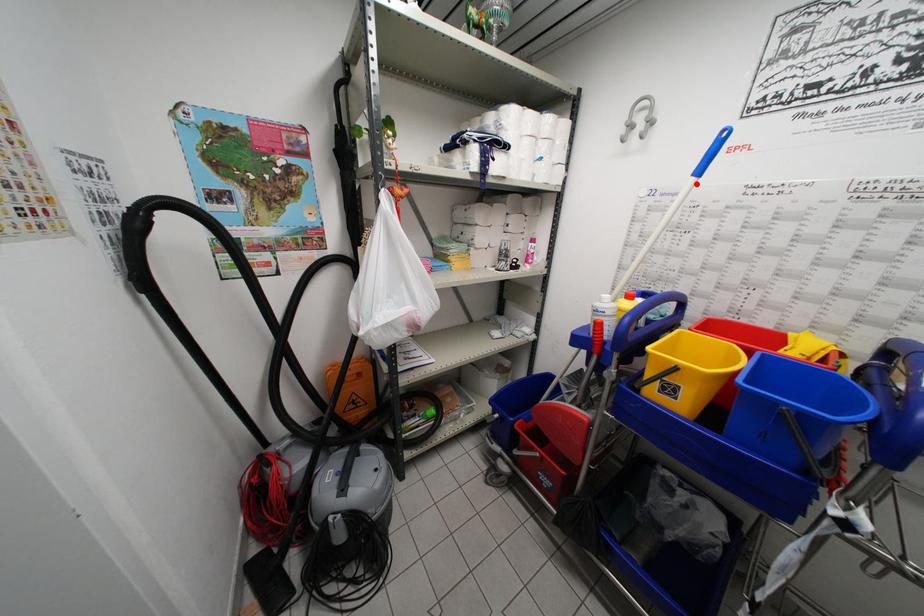
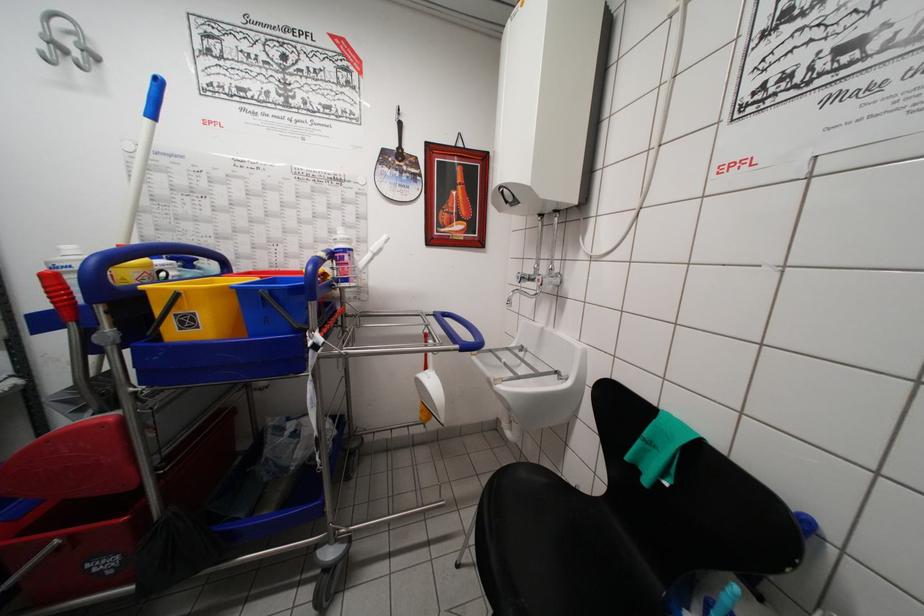
The point at the highlighted location is marked in the first image. Where is the corresponding point in the second image?

(151, 124)